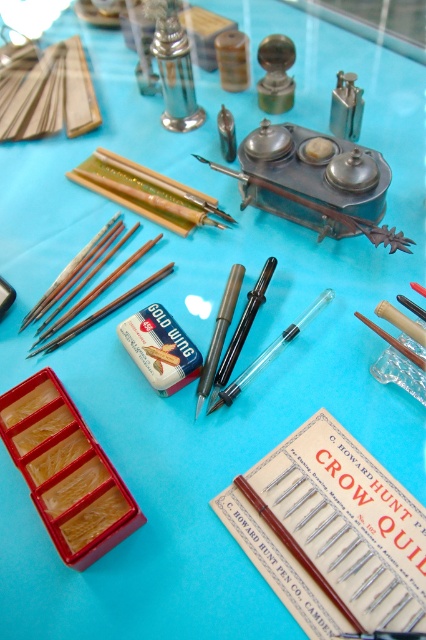
Is satin silver inkwell at center to the right of brown wood paint brush at center-left from the viewer's perspective?

Indeed, satin silver inkwell at center is positioned on the right side of brown wood paint brush at center-left.

Is point (305, 134) positioned before point (86, 256)?

That is False.

Where is `satin silver inkwell at center`? satin silver inkwell at center is located at coordinates (316, 182).

Is transparent plastic paint brush at center shorter than wooden paint brush at center?

No.

Does transparent plastic paint brush at center have a greater height compared to wooden paint brush at center?

Yes.

Is point (268, 353) farther from viewer compared to point (72, 326)?

No, (268, 353) is in front of (72, 326).

Where is `transparent plastic paint brush at center`? This screenshot has width=426, height=640. transparent plastic paint brush at center is located at coordinates (271, 349).

Between point (235, 380) and point (394, 339), which one is positioned behind?

Point (235, 380)

Which is in front, point (328, 292) or point (402, 348)?

Positioned in front is point (402, 348).

I want to click on transparent plastic paint brush at center, so click(x=271, y=349).